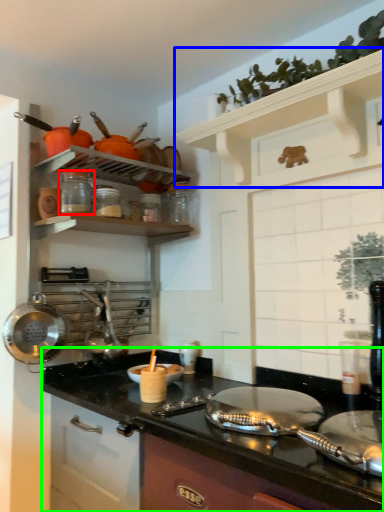
Question: Based on their relative distances, which object is farther from appliance (highlighted by a red box)? Choose from shelf (highlighted by a blue box) and countertop (highlighted by a green box).

Choices:
 (A) shelf
 (B) countertop

Answer: (B)